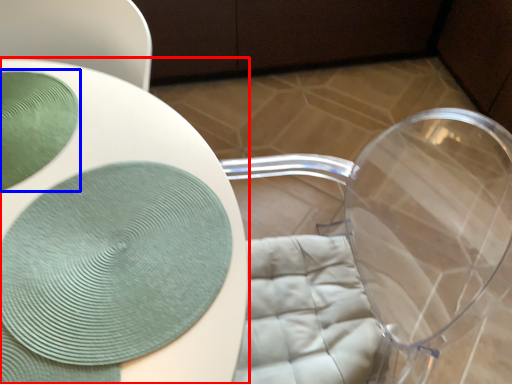
Question: Which point is further to the camera, table (highlighted by a red box) or glass plate (highlighted by a blue box)?

Choices:
 (A) table
 (B) glass plate

Answer: (B)